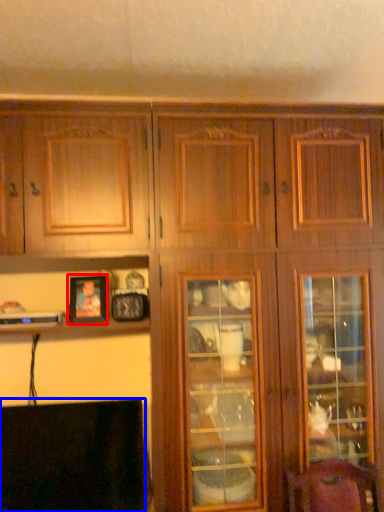
Question: Which object is closer to the camera taking this photo, picture frame (highlighted by a red box) or fireplace (highlighted by a blue box)?

Choices:
 (A) picture frame
 (B) fireplace

Answer: (B)